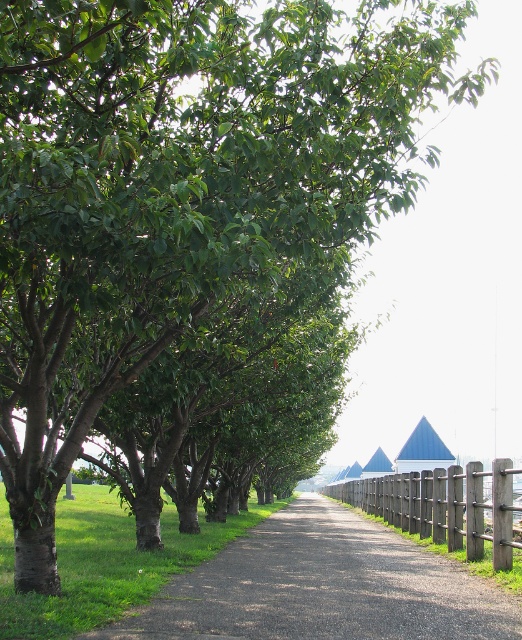
You are standing at the start of the gravel path at center and want to reach the end of the brown wooden fence at center. Which one will you reach first?

The gravel path at center is shorter than the brown wooden fence at center, so you will reach the end of the gravel path at center before reaching the end of the brown wooden fence at center.